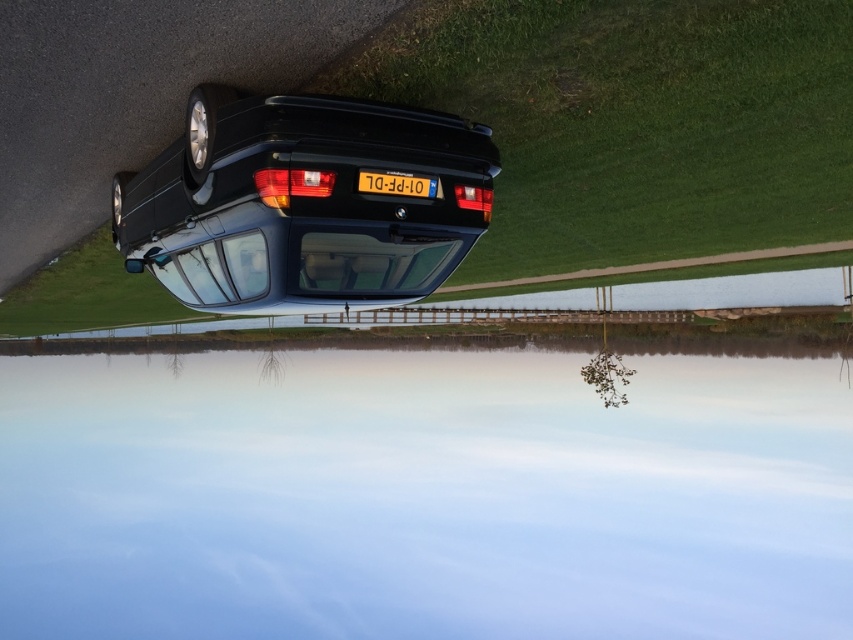
Is point (415, 122) closer to camera compared to point (326, 195)?

No, (415, 122) is further to viewer.

Does glossy black car at center have a greater height compared to matte plastic tail light at center?

Indeed, glossy black car at center has a greater height compared to matte plastic tail light at center.

Is point (283, 262) closer to camera compared to point (256, 170)?

That is False.

You are a GUI agent. You are given a task and a screenshot of the screen. Output one action in this format:
    pyautogui.click(x=<x>, y=<y>)
    Task: Click on the glossy black car at center
    This screenshot has height=640, width=853.
    Given the screenshot: What is the action you would take?
    pyautogui.click(x=300, y=204)

Can you confirm if matte plastic tail light at center is wider than yellow plastic license plate at center?

In fact, matte plastic tail light at center might be narrower than yellow plastic license plate at center.

Who is positioned more to the left, matte plastic tail light at center or yellow plastic license plate at center?

From the viewer's perspective, matte plastic tail light at center appears more on the left side.

Locate an element on the screen. This screenshot has height=640, width=853. matte plastic tail light at center is located at coordinates (291, 184).

Where is `matte plastic tail light at center`? Image resolution: width=853 pixels, height=640 pixels. matte plastic tail light at center is located at coordinates (291, 184).

Which is more to the right, transparent glass water at center or matte black tail light at center?

matte black tail light at center is more to the right.

The height and width of the screenshot is (640, 853). I want to click on transparent glass water at center, so click(427, 493).